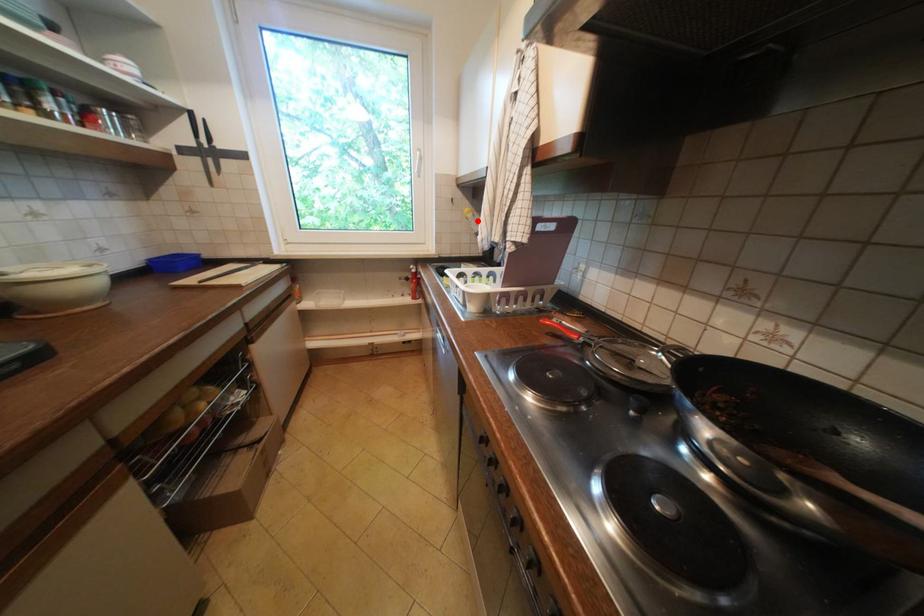
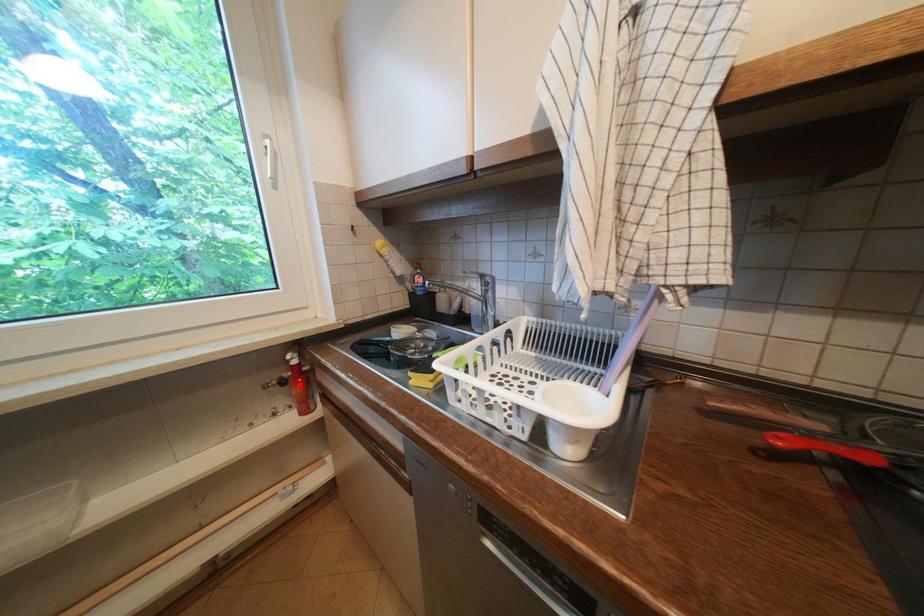
I am providing you with two images of the same scene from different viewpoints. A red point is marked on the first image and another point is marked on the second image. Are the points marked in image1 and image2 representing the same 3D position?

No